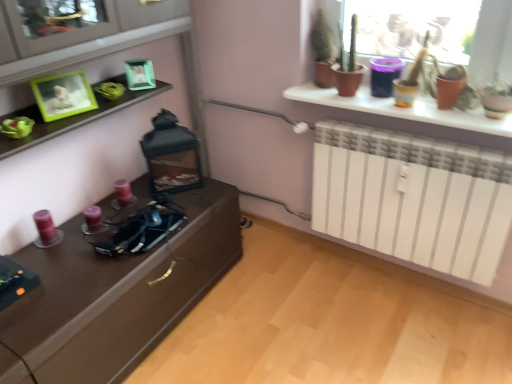
Find the location of a particular element. This screenshot has height=384, width=512. green matte picture frame at upper left, acting as the second picture frame starting from the back is located at coordinates (63, 95).

Describe the element at coordinates (63, 95) in the screenshot. I see `green matte picture frame at upper left, the 1th picture frame viewed from the left` at that location.

Where is `green matte picture frame at upper center, placed as the second picture frame when sorted from front to back`? The image size is (512, 384). green matte picture frame at upper center, placed as the second picture frame when sorted from front to back is located at coordinates (140, 74).

Measure the distance between point (127, 71) and camera.

A distance of 1.83 meters exists between point (127, 71) and camera.

What do you see at coordinates (140, 74) in the screenshot? Image resolution: width=512 pixels, height=384 pixels. I see `green matte picture frame at upper center, placed as the second picture frame when sorted from front to back` at bounding box center [140, 74].

Locate an element on the screen. Image resolution: width=512 pixels, height=384 pixels. green matte picture frame at upper left, the 1th picture frame viewed from the left is located at coordinates (63, 95).

Can you confirm if green matte picture frame at upper center, which appears as the 1th picture frame when viewed from the right, is positioned to the right of green matte picture frame at upper left, the 1th picture frame viewed from the left?

Yes.

In the image, is green matte picture frame at upper center, which appears as the 1th picture frame when viewed from the right, positioned in front of or behind green matte picture frame at upper left, which appears as the 2th picture frame when viewed from the right?

Visually, green matte picture frame at upper center, which appears as the 1th picture frame when viewed from the right, is located behind green matte picture frame at upper left, which appears as the 2th picture frame when viewed from the right.

Does point (126, 73) appear closer or farther from the camera than point (56, 112)?

Clearly, point (126, 73) is more distant from the camera than point (56, 112).

From the image's perspective, is green matte picture frame at upper center, positioned as the 2th picture frame in left-to-right order, located above or below green matte picture frame at upper left, the 1th picture frame viewed from the left?

From the image's perspective, green matte picture frame at upper center, positioned as the 2th picture frame in left-to-right order, appears above green matte picture frame at upper left, the 1th picture frame viewed from the left.

From a real-world perspective, is green matte picture frame at upper center, the 1th picture frame from the back, physically located above or below green matte picture frame at upper left, acting as the second picture frame starting from the back?

green matte picture frame at upper center, the 1th picture frame from the back, is situated lower than green matte picture frame at upper left, acting as the second picture frame starting from the back, in the real world.

Is green matte picture frame at upper center, which appears as the 1th picture frame when viewed from the right, wider than green matte picture frame at upper left, the 1th picture frame viewed from the left?

No, green matte picture frame at upper center, which appears as the 1th picture frame when viewed from the right, is not wider than green matte picture frame at upper left, the 1th picture frame viewed from the left.

Looking at this image, does green matte picture frame at upper center, placed as the second picture frame when sorted from front to back, have a lesser height compared to green matte picture frame at upper left, which appears as the 2th picture frame when viewed from the right?

Yes, green matte picture frame at upper center, placed as the second picture frame when sorted from front to back, is shorter than green matte picture frame at upper left, which appears as the 2th picture frame when viewed from the right.

Is green matte picture frame at upper center, which appears as the 1th picture frame when viewed from the right, bigger than green matte picture frame at upper left, the 1th picture frame viewed from the left?

No, green matte picture frame at upper center, which appears as the 1th picture frame when viewed from the right, is not bigger than green matte picture frame at upper left, the 1th picture frame viewed from the left.

Would you say green matte picture frame at upper center, the 1th picture frame from the back, is outside green matte picture frame at upper left, which appears as the 2th picture frame when viewed from the right?

That's correct, green matte picture frame at upper center, the 1th picture frame from the back, is outside of green matte picture frame at upper left, which appears as the 2th picture frame when viewed from the right.

Is green matte picture frame at upper center, positioned as the 2th picture frame in left-to-right order, next to green matte picture frame at upper left, placed as the first picture frame when sorted from front to back, and touching it?

There is a gap between green matte picture frame at upper center, positioned as the 2th picture frame in left-to-right order, and green matte picture frame at upper left, placed as the first picture frame when sorted from front to back.

Is green matte picture frame at upper center, positioned as the 2th picture frame in left-to-right order, oriented away from green matte picture frame at upper left, the 1th picture frame viewed from the left?

No, green matte picture frame at upper left, the 1th picture frame viewed from the left, is not at the back of green matte picture frame at upper center, positioned as the 2th picture frame in left-to-right order.

Find the location of a particular element. picture frame below the green matte picture frame at upper center, positioned as the 2th picture frame in left-to-right order (from the image's perspective) is located at coordinates (63, 95).

Is green matte picture frame at upper left, which appears as the 2th picture frame when viewed from the right, to the right of green matte picture frame at upper center, positioned as the 2th picture frame in left-to-right order, from the viewer's perspective?

No, green matte picture frame at upper left, which appears as the 2th picture frame when viewed from the right, is not to the right of green matte picture frame at upper center, positioned as the 2th picture frame in left-to-right order.

Considering the relative positions of green matte picture frame at upper left, the 1th picture frame viewed from the left, and green matte picture frame at upper center, positioned as the 2th picture frame in left-to-right order, in the image provided, is green matte picture frame at upper left, the 1th picture frame viewed from the left, in front of green matte picture frame at upper center, positioned as the 2th picture frame in left-to-right order,?

Yes.

Considering the positions of point (51, 89) and point (143, 88), is point (51, 89) closer or farther from the camera than point (143, 88)?

Point (51, 89) is positioned closer to the camera compared to point (143, 88).

From the image's perspective, is green matte picture frame at upper left, the 1th picture frame viewed from the left, on top of green matte picture frame at upper center, which appears as the 1th picture frame when viewed from the right?

No, from the image's perspective, green matte picture frame at upper left, the 1th picture frame viewed from the left, is not on top of green matte picture frame at upper center, which appears as the 1th picture frame when viewed from the right.

From a real-world perspective, who is located higher, green matte picture frame at upper left, acting as the second picture frame starting from the back, or green matte picture frame at upper center, the 1th picture frame from the back?

From a 3D spatial view, green matte picture frame at upper left, acting as the second picture frame starting from the back, is above.

Can you confirm if green matte picture frame at upper left, placed as the first picture frame when sorted from front to back, is thinner than green matte picture frame at upper center, which appears as the 1th picture frame when viewed from the right?

No.

Between green matte picture frame at upper left, which appears as the 2th picture frame when viewed from the right, and green matte picture frame at upper center, placed as the second picture frame when sorted from front to back, which one has less height?

green matte picture frame at upper center, placed as the second picture frame when sorted from front to back.

Is green matte picture frame at upper left, the 1th picture frame viewed from the left, smaller than green matte picture frame at upper center, placed as the second picture frame when sorted from front to back?

Actually, green matte picture frame at upper left, the 1th picture frame viewed from the left, might be larger than green matte picture frame at upper center, placed as the second picture frame when sorted from front to back.

Is green matte picture frame at upper left, placed as the first picture frame when sorted from front to back, completely or partially outside of green matte picture frame at upper center, the 1th picture frame from the back?

Yes, green matte picture frame at upper left, placed as the first picture frame when sorted from front to back, is not within green matte picture frame at upper center, the 1th picture frame from the back.

Is green matte picture frame at upper left, placed as the first picture frame when sorted from front to back, far away from green matte picture frame at upper center, the 1th picture frame from the back?

green matte picture frame at upper left, placed as the first picture frame when sorted from front to back, is actually quite close to green matte picture frame at upper center, the 1th picture frame from the back.

Is green matte picture frame at upper left, acting as the second picture frame starting from the back, looking in the opposite direction of green matte picture frame at upper center, positioned as the 2th picture frame in left-to-right order?

That's not correct — green matte picture frame at upper left, acting as the second picture frame starting from the back, is not looking away from green matte picture frame at upper center, positioned as the 2th picture frame in left-to-right order.

I want to click on picture frame that appears on the left of green matte picture frame at upper center, positioned as the 2th picture frame in left-to-right order, so click(x=63, y=95).

In the image, there is a green matte picture frame at upper center, which appears as the 1th picture frame when viewed from the right. Find the location of `picture frame below it (from the image's perspective)`. picture frame below it (from the image's perspective) is located at coordinates (63, 95).

The width and height of the screenshot is (512, 384). In order to click on picture frame that appears on the left of green matte picture frame at upper center, positioned as the 2th picture frame in left-to-right order in this screenshot , I will do 63,95.